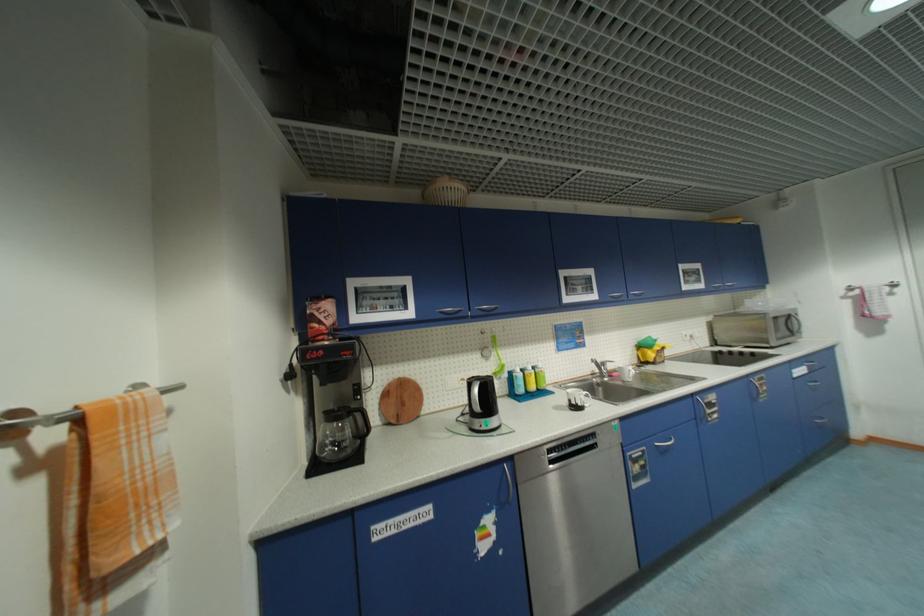
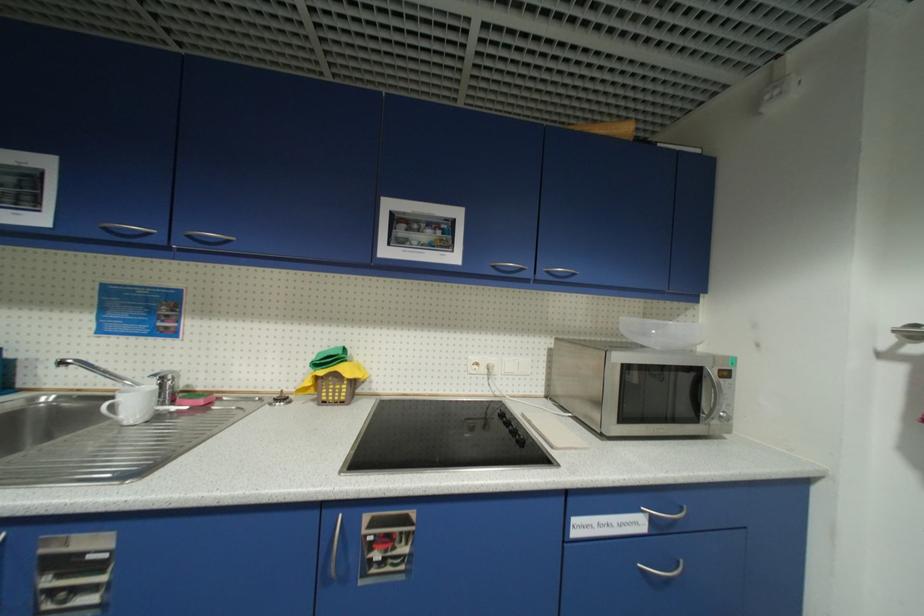
What movement of the cameraman would produce the second image?

The movement direction of the cameraman is right, forward.